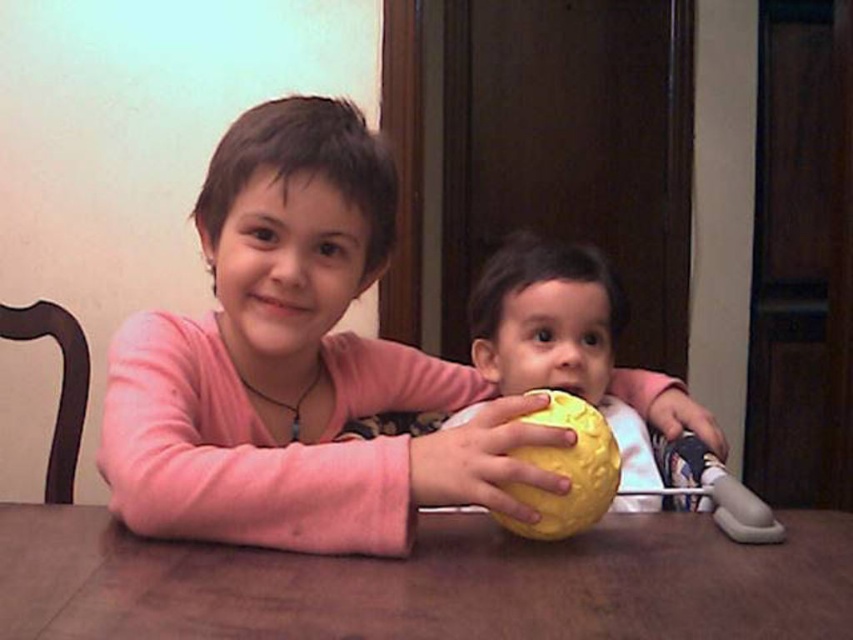
Consider the image. What are the coordinates of the matte yellow ball at center?

The matte yellow ball at center is located at point (296, 364).